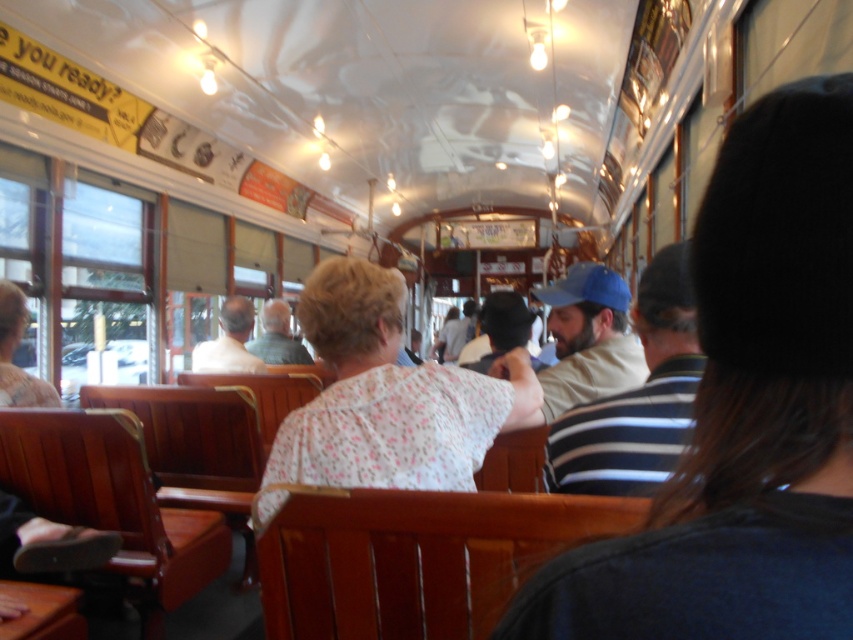
Question: Considering the real-world distances, which object is farthest from the blue fabric cap at center?

Choices:
 (A) floral fabric blouse at center
 (B) light brown leather jacket at center
 (C) striped cotton shirt at center

Answer: (B)

Question: Does floral fabric blouse at center have a smaller size compared to blue fabric cap at center?

Choices:
 (A) yes
 (B) no

Answer: (B)

Question: Which object appears closest to the camera in this image?

Choices:
 (A) floral fabric blouse at center
 (B) striped cotton shirt at center
 (C) blue fabric cap at center
 (D) light brown leather jacket at center

Answer: (B)

Question: Where is striped cotton shirt at center located in relation to floral fabric blouse at center in the image?

Choices:
 (A) above
 (B) below

Answer: (A)

Question: Which of these objects is positioned closest to the striped cotton shirt at center?

Choices:
 (A) light brown leather jacket at center
 (B) blue fabric cap at center
 (C) floral fabric blouse at center

Answer: (B)

Question: Does floral fabric blouse at center have a smaller size compared to light brown leather jacket at center?

Choices:
 (A) no
 (B) yes

Answer: (A)